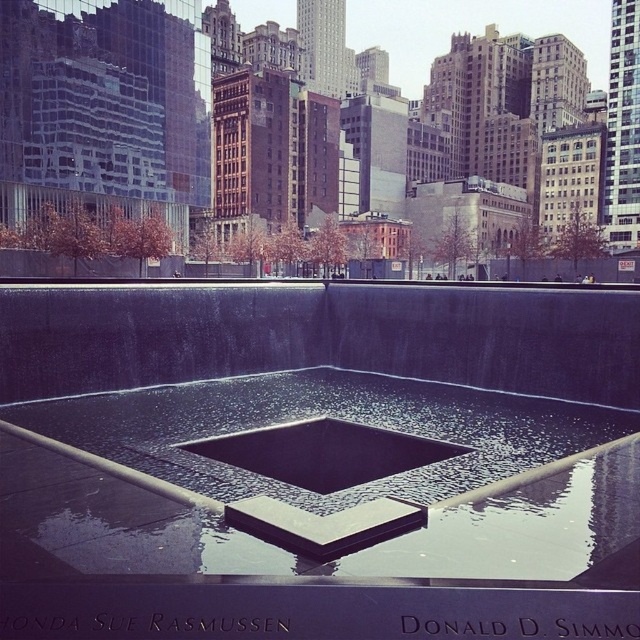
You are standing at the origin point in the image. Which direction should you move to reach the black polished concrete water at center?

The black polished concrete water at center is located at coordinates 0.667 on the x axis and 0.506 on the y axis. Since you are at the origin point, you should move towards the right along the x axis to reach it.

You are an architect reviewing a design for a new memorial. The design includes two types of water features at the center. The first is labeled as black polished concrete water at center, and the second is black textured water at center. According to the design, which water feature is layered on top of the other?

The black polished concrete water at center is positioned over the black textured water at center, meaning the polished concrete layer is on top.

You are standing in a public memorial space and want to toss a flower into the black polished concrete water at center. If your arm can reach 2 meters, will you be able to reach the water?

The black polished concrete water at center is 3.81 meters away from the viewer. Since your arm can only reach 2 meters, you cannot reach the water.